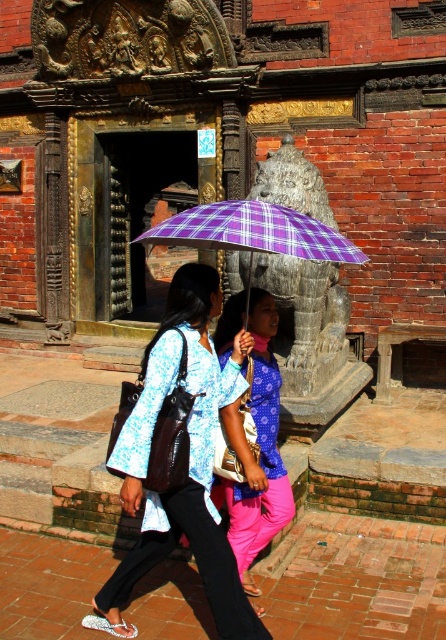
Can you confirm if matte purple umbrella at center is positioned below purple checkered umbrella at center?

Correct, matte purple umbrella at center is located below purple checkered umbrella at center.

Is matte purple umbrella at center taller than purple checkered umbrella at center?

Yes.

Is point (247, 452) behind point (268, 248)?

Yes, it is behind point (268, 248).

Locate an element on the screen. matte purple umbrella at center is located at coordinates (260, 451).

Based on the photo, does matte blue blouse at center appear over matte purple umbrella at center?

Yes.

In the scene shown: Is matte blue blouse at center shorter than matte purple umbrella at center?

No.

Who is more distant from viewer, (214, 598) or (277, 484)?

The point (277, 484) is more distant.

Image resolution: width=446 pixels, height=640 pixels. What are the coordinates of `matte blue blouse at center` in the screenshot? It's located at (189, 461).

Measure the distance from matte blue blouse at center to purple checkered umbrella at center.

1.23 meters

Does matte blue blouse at center appear on the left side of purple checkered umbrella at center?

Yes, matte blue blouse at center is to the left of purple checkered umbrella at center.

Is point (103, 588) positioned behind point (300, 220)?

No, it is not.

The height and width of the screenshot is (640, 446). What are the coordinates of `matte blue blouse at center` in the screenshot? It's located at (189, 461).